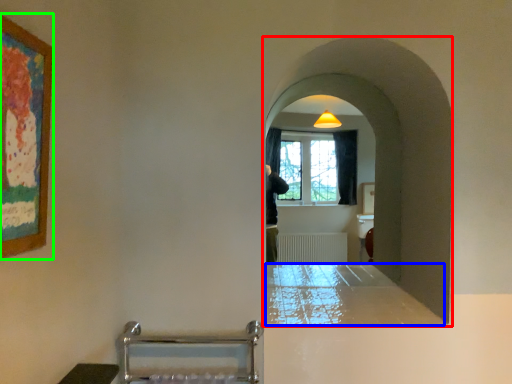
Question: Considering the real-world distances, which object is farthest from passage (highlighted by a red box)? counter top (highlighted by a blue box) or picture frame (highlighted by a green box)?

Choices:
 (A) counter top
 (B) picture frame

Answer: (B)